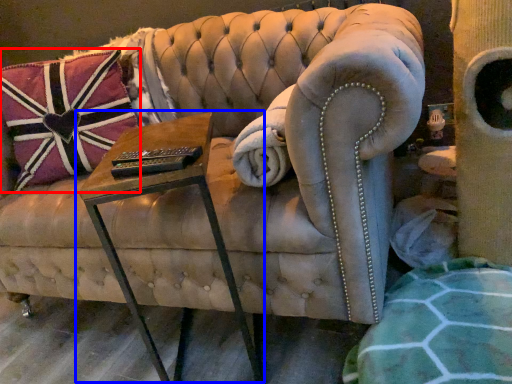
Question: Which object appears closest to the camera in this image, pillow (highlighted by a red box) or table (highlighted by a blue box)?

Choices:
 (A) pillow
 (B) table

Answer: (B)